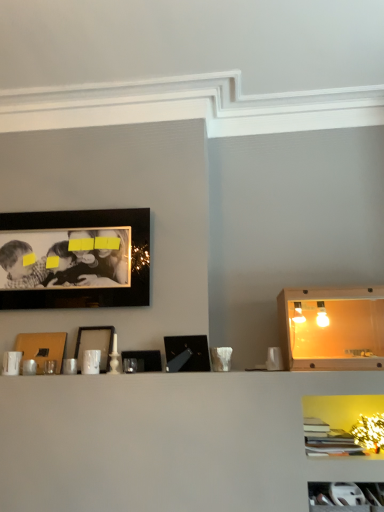
Question: From a real-world perspective, is white plastic cabinet at lower right, arranged as the 2th cabinet when viewed from the top, above or below matte brown picture frame at center-left, the first picture frame from the left?

Choices:
 (A) above
 (B) below

Answer: (B)

Question: Is white plastic cabinet at lower right, arranged as the 2th cabinet when viewed from the top, in front of or behind matte brown picture frame at center-left, which ranks as the 5th picture frame in right-to-left order, in the image?

Choices:
 (A) front
 (B) behind

Answer: (A)

Question: Estimate the real-world distances between objects in this image. Which object is farther from the matte brown picture frame at center-left, which ranks as the 5th picture frame in right-to-left order?

Choices:
 (A) black matte picture frame at center, which is the 4th picture frame from left to right
 (B) matte black picture frame at center, arranged as the third picture frame when viewed from the left
 (C) wooden cabinet at right, arranged as the 1th cabinet when viewed from the back
 (D) black glossy picture frame at center, the 1th picture frame from the right
 (E) white plastic cabinet at lower right, the second cabinet viewed from the back

Answer: (E)

Question: Considering the real-world distances, which object is closest to the black matte picture frame at center, which is counted as the 2th picture frame, starting from the right?

Choices:
 (A) matte black picture frame at center, arranged as the third picture frame when viewed from the left
 (B) matte brown picture frame at center-left, which ranks as the 5th picture frame in right-to-left order
 (C) black glossy picture frame at center, the 1th picture frame from the right
 (D) wooden cabinet at right, arranged as the 1th cabinet when viewed from the back
 (E) black matte picture frame at upper left, marked as the fourth picture frame in a right-to-left arrangement

Answer: (C)